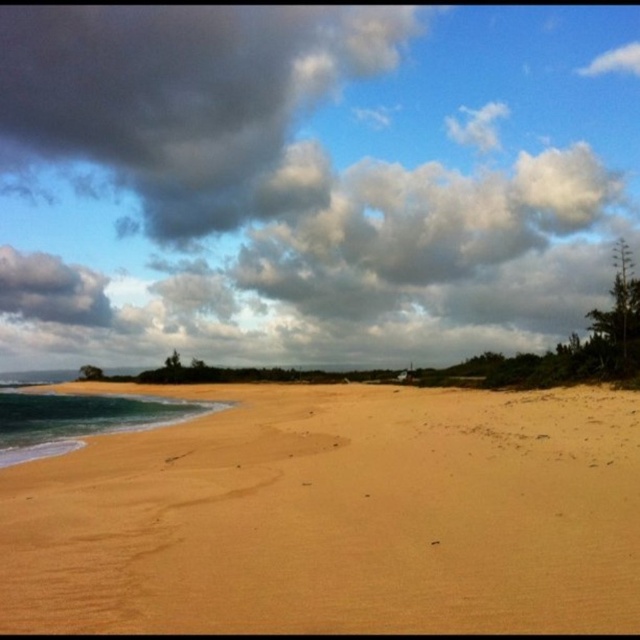
What do you see at coordinates (333, 515) in the screenshot? Image resolution: width=640 pixels, height=640 pixels. I see `sandy yellow beach at lower left` at bounding box center [333, 515].

Who is more forward, (600,552) or (97,403)?

Point (600,552) is more forward.

Measure the distance between sandy yellow beach at lower left and camera.

The distance of sandy yellow beach at lower left from camera is 8.99 meters.

This screenshot has height=640, width=640. What are the coordinates of `sandy yellow beach at lower left` in the screenshot? It's located at (333, 515).

Who is positioned more to the right, dark gray cloud at upper left or blue glossy water at lower left?

blue glossy water at lower left is more to the right.

Is point (60, 99) closer to viewer compared to point (68, 429)?

No, it is not.

Is point (157, 106) positioned after point (61, 445)?

Yes.

Where is `dark gray cloud at upper left`? dark gray cloud at upper left is located at coordinates (186, 99).

Can you confirm if sandy yellow beach at lower left is positioned to the right of dark gray cloud at upper left?

Indeed, sandy yellow beach at lower left is positioned on the right side of dark gray cloud at upper left.

Find the location of a particular element. The width and height of the screenshot is (640, 640). sandy yellow beach at lower left is located at coordinates (333, 515).

You are a GUI agent. You are given a task and a screenshot of the screen. Output one action in this format:
    pyautogui.click(x=<x>, y=<y>)
    Task: Click on the sandy yellow beach at lower left
    This screenshot has height=640, width=640.
    Given the screenshot: What is the action you would take?
    pyautogui.click(x=333, y=515)